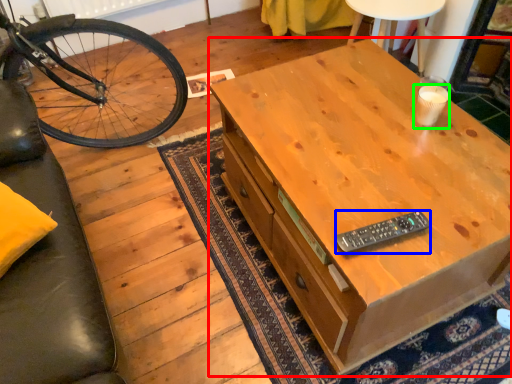
Question: Based on their relative distances, which object is nearer to desk (highlighted by a red box)? Choose from remote control (highlighted by a blue box) and coffee cup (highlighted by a green box).

Choices:
 (A) remote control
 (B) coffee cup

Answer: (A)